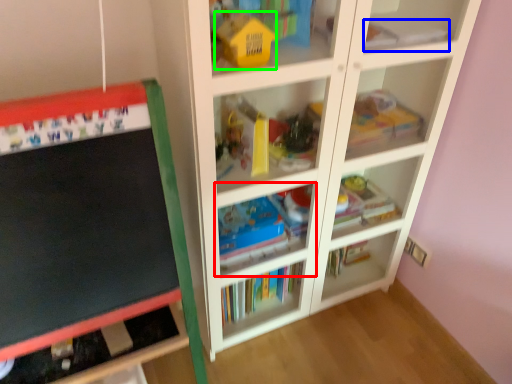
Question: Which is nearer to the shelf (highlighted by a red box)? book (highlighted by a blue box) or toy (highlighted by a green box).

Choices:
 (A) book
 (B) toy

Answer: (B)